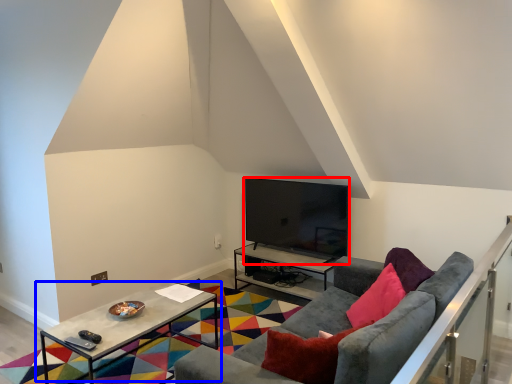
Question: Which of the following is the farthest to the observer, television (highlighted by a red box) or table (highlighted by a blue box)?

Choices:
 (A) television
 (B) table

Answer: (A)